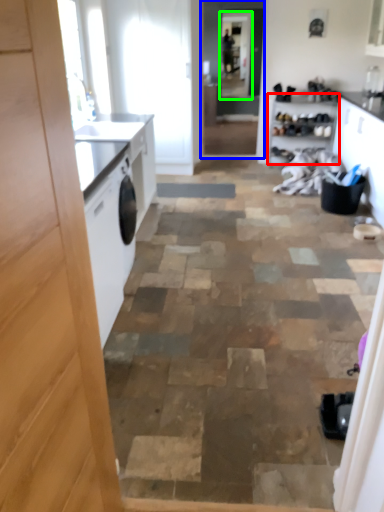
Question: Which is nearer to the cabinetry (highlighted by a red box)? screen door (highlighted by a blue box) or screen door (highlighted by a green box).

Choices:
 (A) screen door
 (B) screen door

Answer: (A)